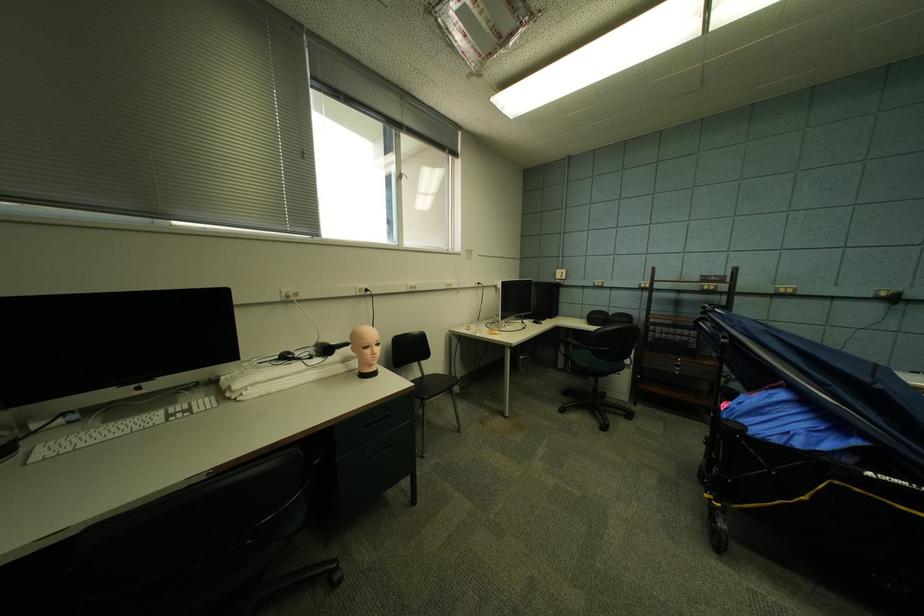
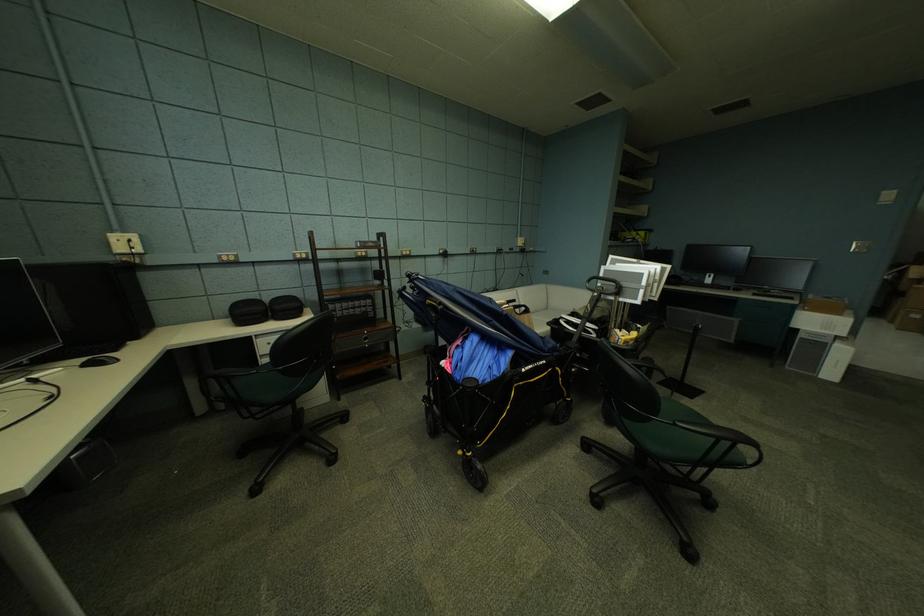
Question: The first image is from the beginning of the video and the second image is from the end. How did the camera likely rotate when shooting the video?

Choices:
 (A) Left
 (B) Right
 (C) Up
 (D) Down

Answer: (B)